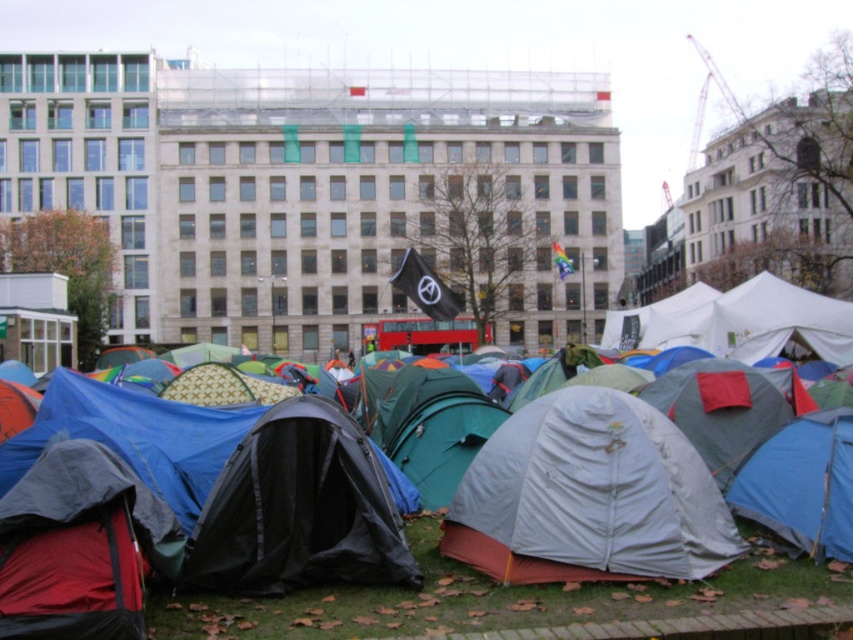
You are a visitor at the event and want to find the white matte tent at center. From the multicolored tents at center, which direction should you move to locate it?

The white matte tent at center is to the right of the multicolored tents at center, so you should move to the right from the multicolored tents at center to find it.

You are organizing a community event and need to determine which tent can accommodate more people. Based on the image, which tent between the multicolored tents at center and the white matte tent at center is larger?

The white matte tent at center is larger than the multicolored tents at center, so it can accommodate more people.